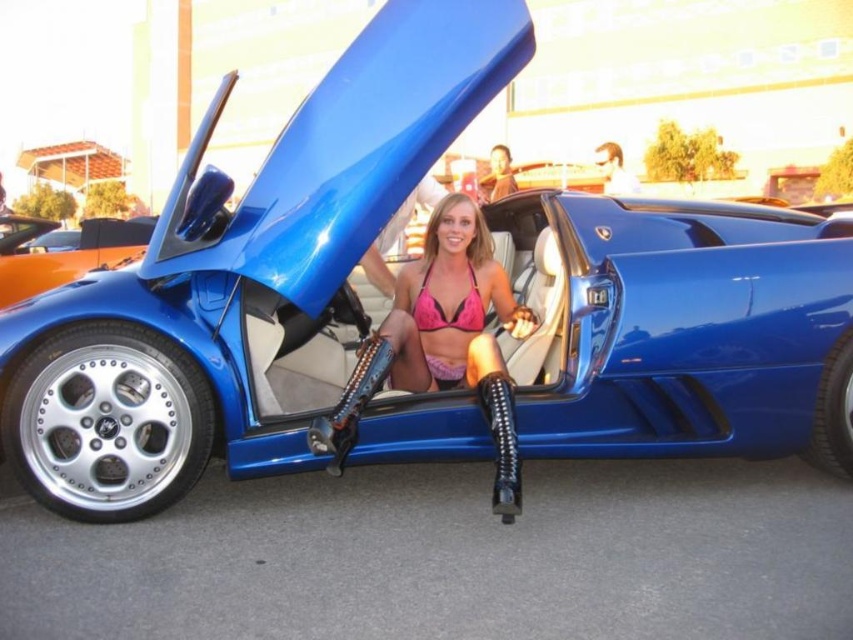
Question: In this image, where is blue metallic car door at upper left located relative to pink matte bikini top at center?

Choices:
 (A) right
 (B) left

Answer: (B)

Question: Among these points, which one is farthest from the camera?

Choices:
 (A) (422, 289)
 (B) (96, 260)

Answer: (B)

Question: Which of the following is the closest to the observer?

Choices:
 (A) pink bikini top at center
 (B) pink matte bikini top at center

Answer: (A)

Question: Which object is the closest to the pink matte bikini top at center?

Choices:
 (A) blue metallic car door at upper left
 (B) pink bikini top at center

Answer: (B)

Question: Does blue metallic car door at upper left appear over pink matte bikini top at center?

Choices:
 (A) no
 (B) yes

Answer: (B)

Question: Does blue metallic car door at upper left come behind pink matte bikini top at center?

Choices:
 (A) no
 (B) yes

Answer: (B)